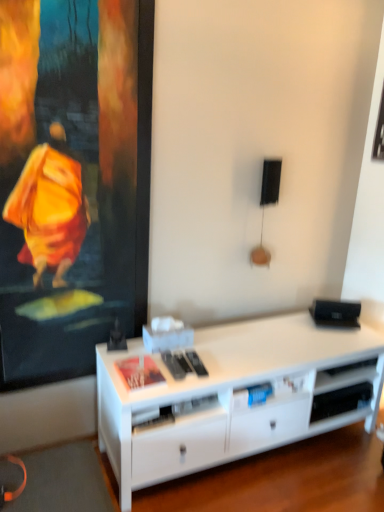
I want to click on free spot above white matte desk at center (from a real-world perspective), so click(x=267, y=346).